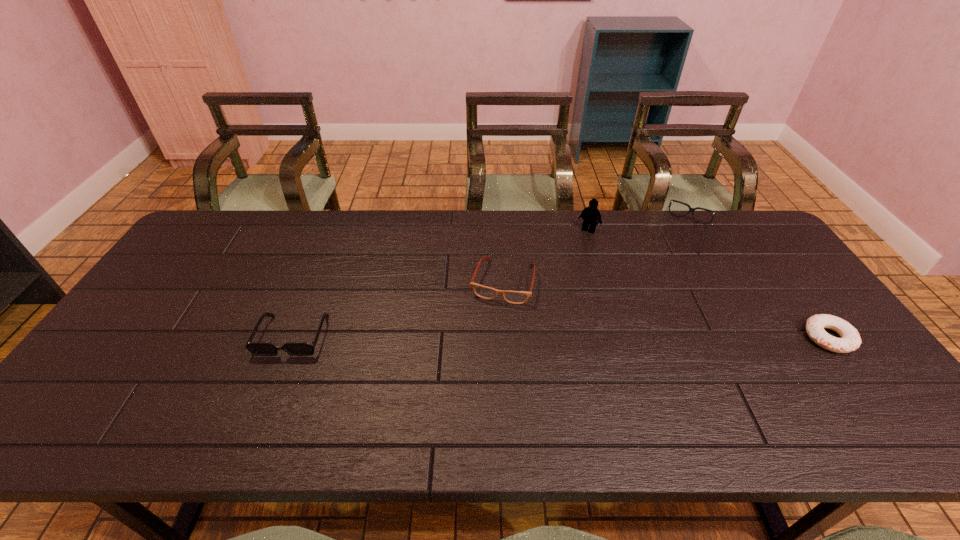
Identify which object is located as the fourth nearest to the right spectacles. Please provide its 2D coordinates. Your answer should be formatted as a tuple, i.e. [(x, y)], where the tuple contains the x and y coordinates of a point satisfying the conditions above.

[(258, 349)]

Identify the location of vacant space that satisfies the following two spatial constraints: 1. on the back side of the third object from right to left; 2. on the left side of the left spectacles. (499, 230).

I want to click on free location that satisfies the following two spatial constraints: 1. on the front side of the tallest object; 2. on the left side of the rightmost object, so click(x=620, y=338).